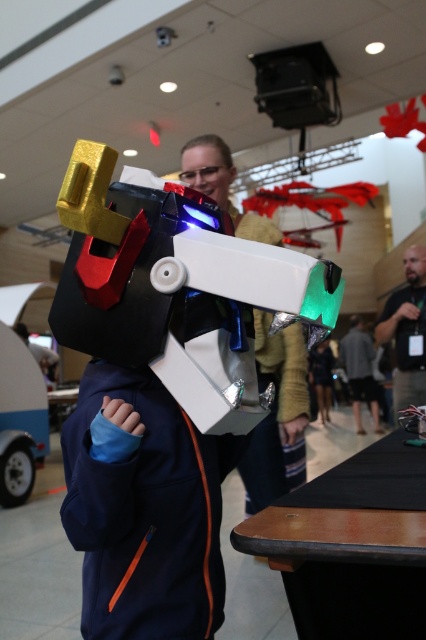
You are an event organizer trying to set up a photo booth backdrop. The backdrop has a height limit of 1.5 meters. You need to position both the matte plastic head at center and the matte black helmet at center. Which object will exceed the backdrop height limit?

The matte plastic head at center is taller than the matte black helmet at center, so it will exceed the backdrop height limit of 1.5 meters if its height surpasses that measurement.

You are a photographer standing at the front of the convention hall. You want to take a closeup photo of the matte plastic head at center. The camera you have can only focus on objects within 1.5 meters. Can you get a clear photo without moving closer?

The matte plastic head at center is 1.75 meters from viewer, which is beyond the camera focus range of 1.5 meters. Therefore, you cannot get a clear photo without moving closer.

You are at a convention and see the matte plastic head at center and the matte black helmet at center. Which one is positioned to the left?

The matte plastic head at center is positioned to the left of the matte black helmet at center.